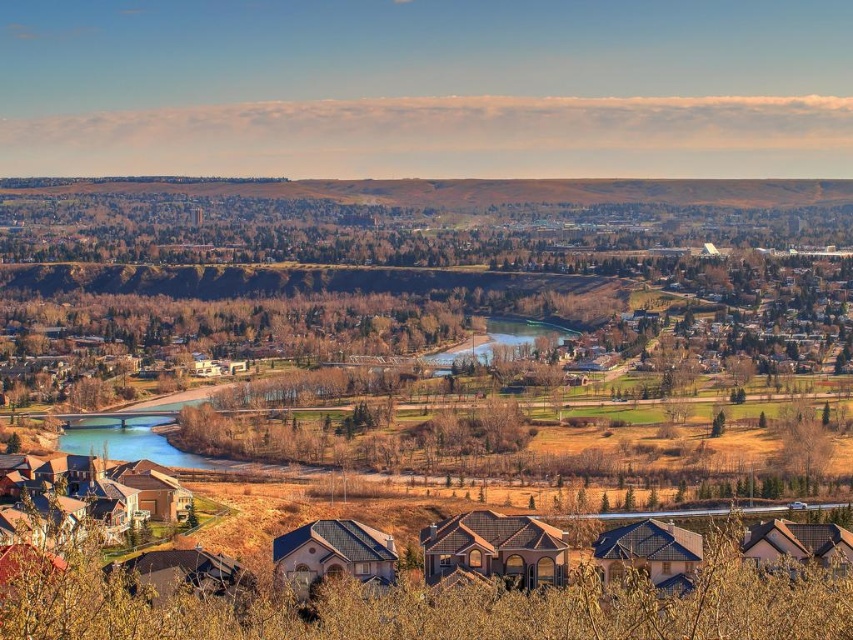
Question: Does clear glass river at center lie in front of greenish-brown water at center?

Choices:
 (A) no
 (B) yes

Answer: (B)

Question: Does clear glass river at center lie behind greenish-brown water at center?

Choices:
 (A) no
 (B) yes

Answer: (A)

Question: Is clear glass river at center above greenish-brown water at center?

Choices:
 (A) yes
 (B) no

Answer: (B)

Question: Which point is closer to the camera taking this photo?

Choices:
 (A) click(473, 339)
 (B) click(108, 419)

Answer: (A)